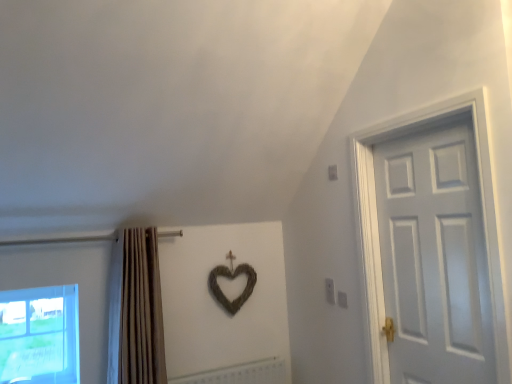
Question: From the image's perspective, is transparent glass window at lower left positioned above or below white matte radiator at center?

Choices:
 (A) below
 (B) above

Answer: (B)

Question: Considering the positions of transparent glass window at lower left and white matte radiator at center in the image, is transparent glass window at lower left bigger or smaller than white matte radiator at center?

Choices:
 (A) big
 (B) small

Answer: (A)

Question: Which is nearer to the transparent glass window at lower left?

Choices:
 (A) beige fabric curtain at left
 (B) white matte radiator at center
 (C) white matte door at right

Answer: (A)

Question: Estimate the real-world distances between objects in this image. Which object is farther from the white matte door at right?

Choices:
 (A) beige fabric curtain at left
 (B) white matte radiator at center
 (C) transparent glass window at lower left

Answer: (C)